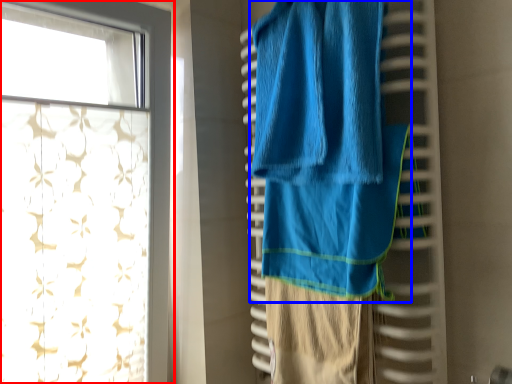
Question: Among these objects, which one is nearest to the camera, curtain (highlighted by a red box) or towel (highlighted by a blue box)?

Choices:
 (A) curtain
 (B) towel

Answer: (B)